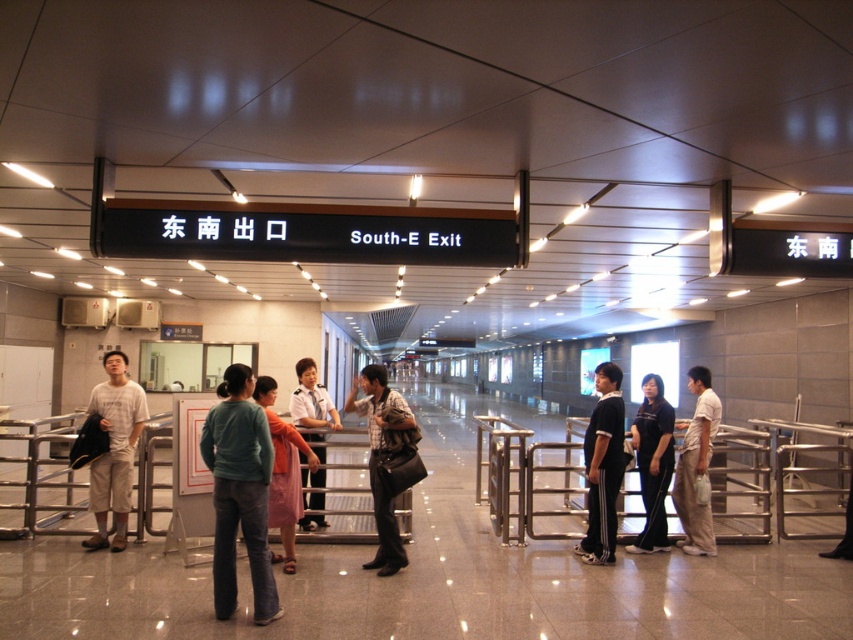
You are a photographer positioned at the entrance of the subway station. You need to capture a photo of both the black fabric pants at center and the orange fabric dress at center. Which clothing item will appear wider in the photo?

The orange fabric dress at center will appear wider in the photo since it has a greater width compared to the black fabric pants at center.